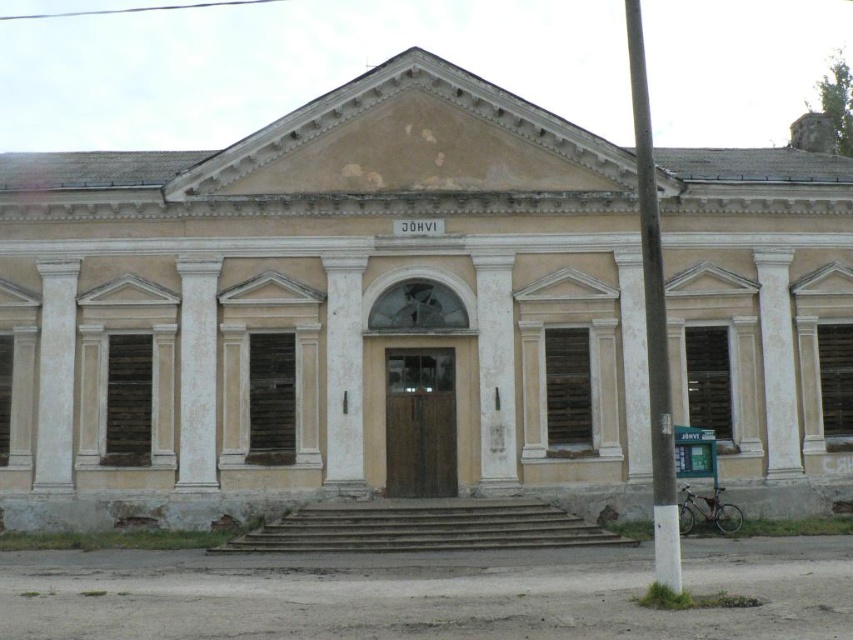
Question: Does white smooth column at center lie in front of white smooth pillar at center?

Choices:
 (A) yes
 (B) no

Answer: (B)

Question: Among these objects, which one is farthest from the camera?

Choices:
 (A) white marble pillar at center
 (B) white smooth pillar at center

Answer: (A)

Question: Can you confirm if white painted wood pole at center right is positioned to the right of white textured column at right?

Choices:
 (A) yes
 (B) no

Answer: (B)

Question: Among these points, which one is nearest to the camera?

Choices:
 (A) (514, 387)
 (B) (186, 445)
 (C) (764, 456)

Answer: (B)

Question: Does white painted wood pole at center right have a greater width compared to white smooth pillar at center?

Choices:
 (A) yes
 (B) no

Answer: (A)

Question: Which point is closer to the camera?

Choices:
 (A) white smooth pillar at center
 (B) white textured column at right
 (C) white painted wood pole at center right

Answer: (C)